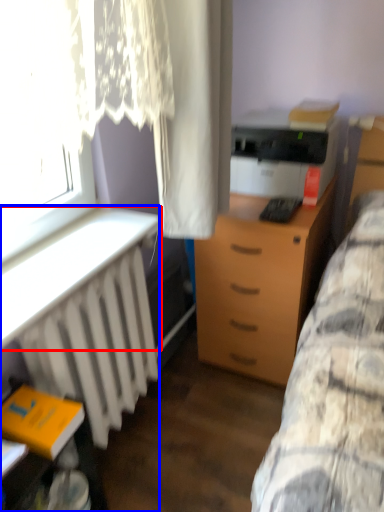
Question: Among these objects, which one is nearest to the camera, table (highlighted by a red box) or desk (highlighted by a blue box)?

Choices:
 (A) table
 (B) desk

Answer: (A)